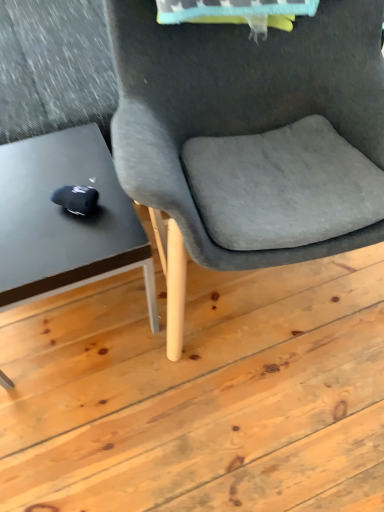
Question: Based on their positions, is matte black table at left located to the left or right of suede gray chair at center?

Choices:
 (A) right
 (B) left

Answer: (B)

Question: In terms of width, does matte black table at left look wider or thinner when compared to suede gray chair at center?

Choices:
 (A) thin
 (B) wide

Answer: (A)

Question: Considering the positions of matte black table at left and suede gray chair at center in the image, is matte black table at left bigger or smaller than suede gray chair at center?

Choices:
 (A) big
 (B) small

Answer: (B)

Question: Considering the positions of point (137, 0) and point (49, 250), is point (137, 0) closer or farther from the camera than point (49, 250)?

Choices:
 (A) farther
 (B) closer

Answer: (A)

Question: Is suede gray chair at center spatially inside matte black table at left, or outside of it?

Choices:
 (A) inside
 (B) outside

Answer: (B)

Question: From the image's perspective, is suede gray chair at center located above or below matte black table at left?

Choices:
 (A) above
 (B) below

Answer: (A)

Question: Would you say suede gray chair at center is to the left or to the right of matte black table at left in the picture?

Choices:
 (A) left
 (B) right

Answer: (B)